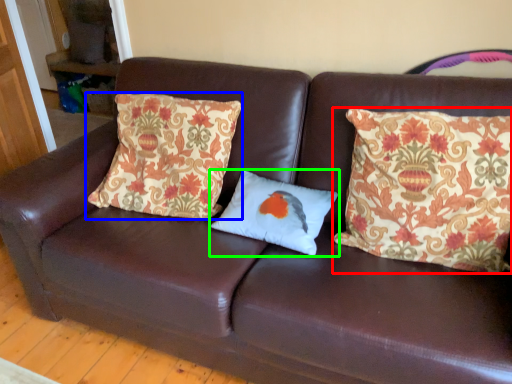
Question: Considering the real-world distances, which object is closest to pillow (highlighted by a red box)? pillow (highlighted by a blue box) or pillow (highlighted by a green box).

Choices:
 (A) pillow
 (B) pillow

Answer: (B)